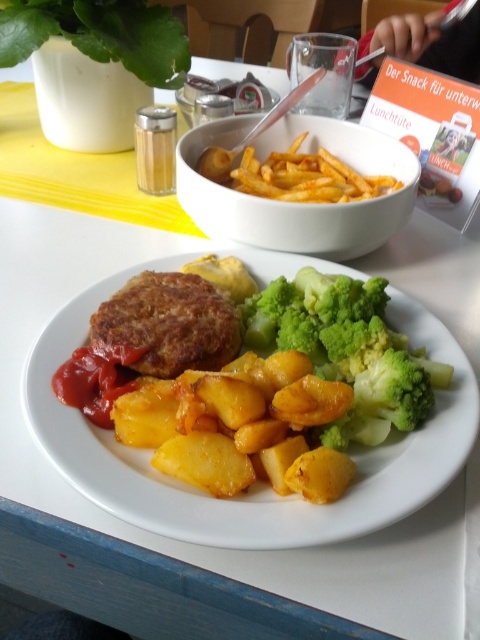
Does point (431, 497) lie behind point (338, 342)?

No.

Does matte brown plate at center appear over green broccoli at center?

Actually, matte brown plate at center is below green broccoli at center.

This screenshot has height=640, width=480. What do you see at coordinates (253, 488) in the screenshot?
I see `matte brown plate at center` at bounding box center [253, 488].

Locate an element on the screen. matte brown plate at center is located at coordinates (253, 488).

Does green broccoli at center appear over green leafy vegetable at upper left?

No.

Is point (348, 417) farther from viewer compared to point (137, 10)?

That is False.

Image resolution: width=480 pixels, height=640 pixels. I want to click on green broccoli at center, so click(x=348, y=349).

Does green broccoli at center have a smaller size compared to brown crispy patty at center?

No.

Which of these two, green broccoli at center or brown crispy patty at center, stands shorter?

brown crispy patty at center

Is point (307, 333) in front of point (194, 280)?

Yes, point (307, 333) is in front of point (194, 280).

This screenshot has width=480, height=640. What are the coordinates of `green broccoli at center` in the screenshot? It's located at (348, 349).